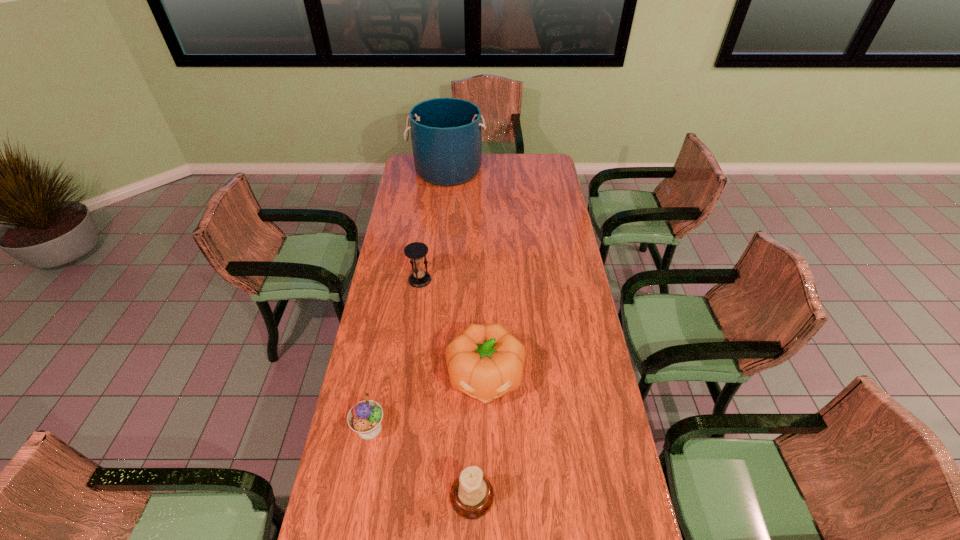
Find the location of a particular element. bucket is located at coordinates tap(446, 137).

The width and height of the screenshot is (960, 540). In order to click on the farthest object in this screenshot , I will do `click(446, 137)`.

This screenshot has width=960, height=540. Find the location of `pumpkin`. pumpkin is located at coordinates (485, 361).

At what (x,y) coordinates should I click in order to perform the action: click on hourglass. Please return your answer as a coordinate pair (x, y). This screenshot has width=960, height=540. Looking at the image, I should click on (415, 251).

Where is `candle holder`? candle holder is located at coordinates (471, 496).

Locate an element on the screen. The width and height of the screenshot is (960, 540). icecream is located at coordinates (365, 417).

I want to click on free region located on the front of the bucket, so click(443, 226).

Find the location of `vacant space located 0.090m on the carved face of the pumpkin`. vacant space located 0.090m on the carved face of the pumpkin is located at coordinates (486, 440).

Where is `vacant area located 0.290m on the right of the fourth nearest object`? vacant area located 0.290m on the right of the fourth nearest object is located at coordinates (500, 280).

What are the coordinates of `vacant space located 0.230m on the back of the nearest object` in the screenshot? It's located at (473, 403).